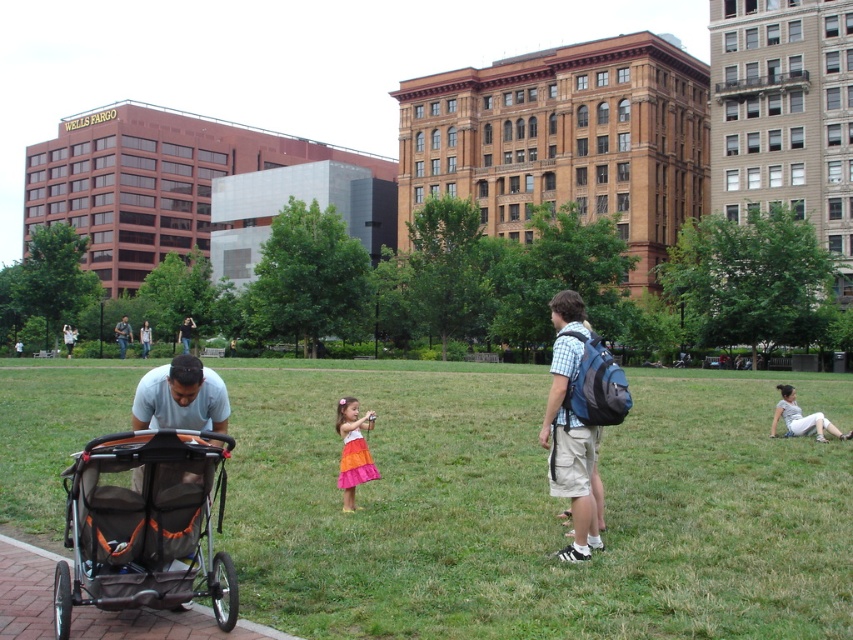
You are a photographer trying to capture a photo of the orange mesh baby carriage at lower left and the blue denim jeans at center. To ensure both are in frame, should you adjust your camera to the left or right?

The orange mesh baby carriage at lower left is to the right of the blue denim jeans at center, so you should adjust your camera to the left to include both in the frame.

You are standing in the urban park scene. There are two points marked in the image. The first point is at coordinates point (793, 440) and the second point is at point (219, 596). Which point is closer to you?

Point (219, 596) is closer to you because point (793, 440) is further away from the camera than point (219, 596).

You are a park visitor who wants to place a 1.5 meters wide picnic blanket between the green grass at center and the orange mesh baby carriage at lower left. Is there enough space?

The distance between the green grass at center and the orange mesh baby carriage at lower left is 7.95 meters, which is more than enough space to place a 1.5 meters wide picnic blanket between them.